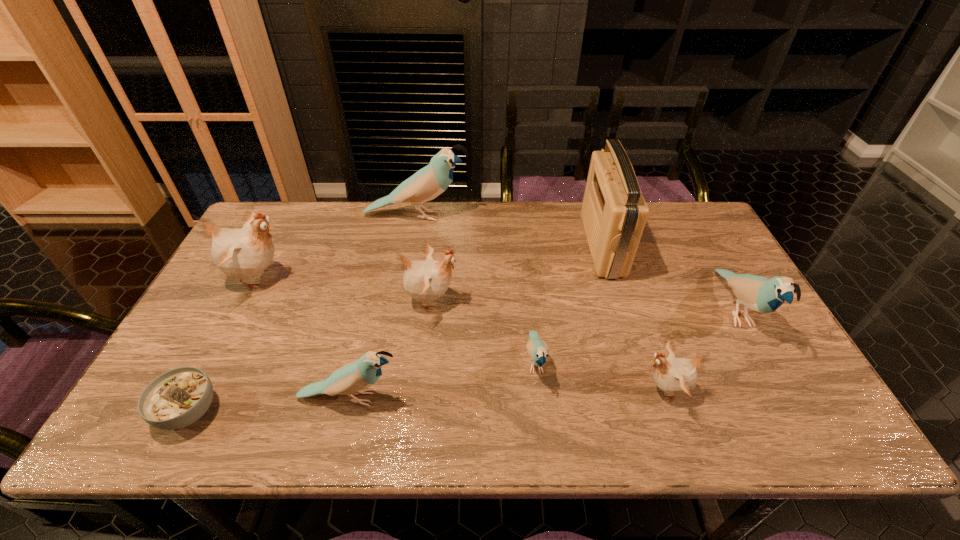
Identify the location of object that is the eighth closest to the beige radio receiver. This screenshot has height=540, width=960. 179,397.

The width and height of the screenshot is (960, 540). Identify the location of the closest bird to the biggest white bird. (429, 182).

Locate which bird is the fifth closest to the beige radio receiver. Please provide its 2D coordinates. Your answer should be formatted as a tuple, i.e. [(x, y)], where the tuple contains the x and y coordinates of a point satisfying the conditions above.

[(425, 281)]

This screenshot has height=540, width=960. Find the location of `blue bird that is the third closest to the leftmost bird`. blue bird that is the third closest to the leftmost bird is located at coordinates (538, 350).

Where is `the closest blue bird to the beige radio receiver`? the closest blue bird to the beige radio receiver is located at coordinates (757, 293).

Identify the location of white bird that stands as the second closest to the biggest blue bird. (425, 281).

This screenshot has width=960, height=540. Find the location of `white bird that is the third closest one to the biggest blue bird`. white bird that is the third closest one to the biggest blue bird is located at coordinates (676, 376).

Locate an element on the screen. free location that satisfies the following two spatial constraints: 1. at the face of the farthest blue bird; 2. on the front side of the white soup bowl is located at coordinates (382, 411).